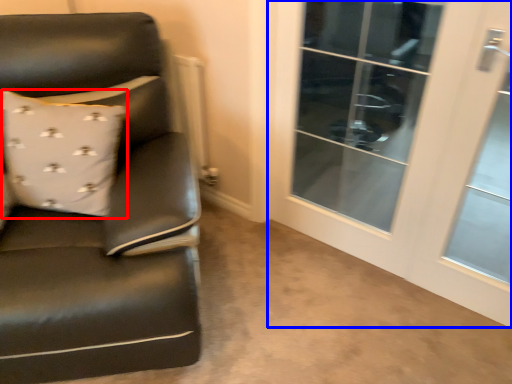
Question: Which object appears closest to the camera in this image, pillow (highlighted by a red box) or screen door (highlighted by a blue box)?

Choices:
 (A) pillow
 (B) screen door

Answer: (B)